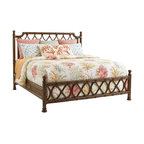
Find the location of a particular element. Image resolution: width=144 pixels, height=144 pixels. orange sheet is located at coordinates (19, 65).